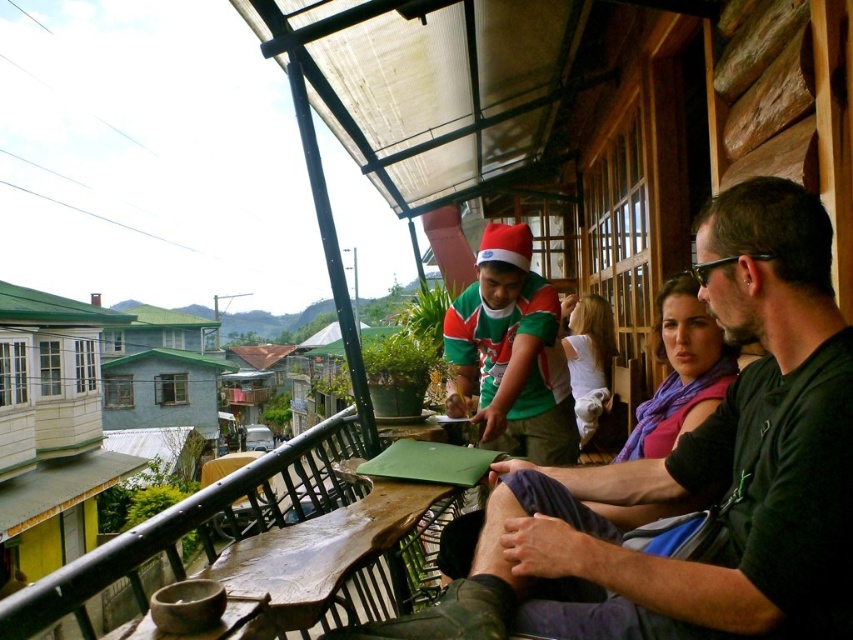
Question: Is green jersey at center below green knitted sweater at center?

Choices:
 (A) no
 (B) yes

Answer: (B)

Question: Is green jersey at center wider than green knitted sweater at center?

Choices:
 (A) no
 (B) yes

Answer: (B)

Question: Which of the following is the farthest from the observer?

Choices:
 (A) (836, 360)
 (B) (532, 372)

Answer: (B)

Question: Where is green jersey at center located in relation to green knitted sweater at center in the image?

Choices:
 (A) below
 (B) above

Answer: (A)

Question: Which object appears farthest from the camera in this image?

Choices:
 (A) green knitted sweater at center
 (B) green jersey at center

Answer: (A)